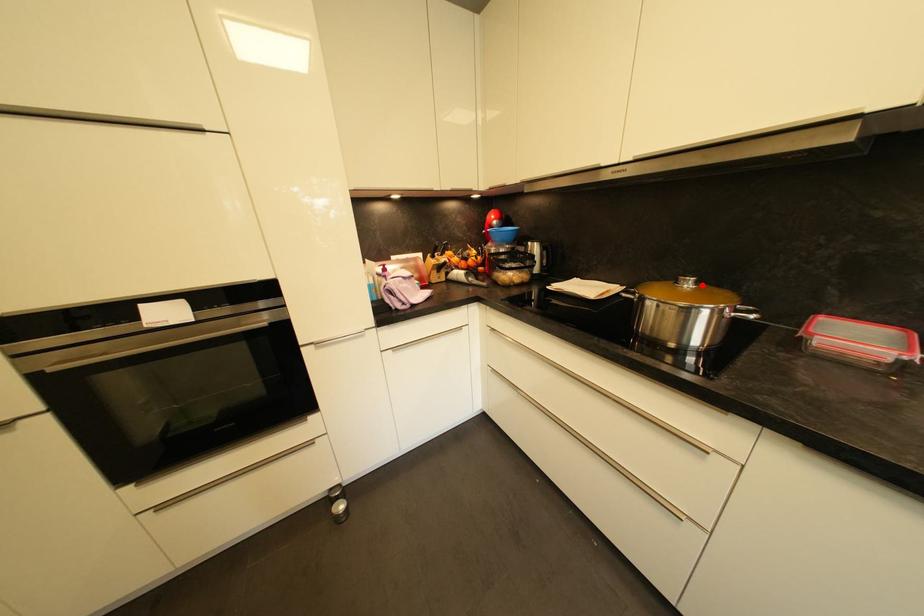
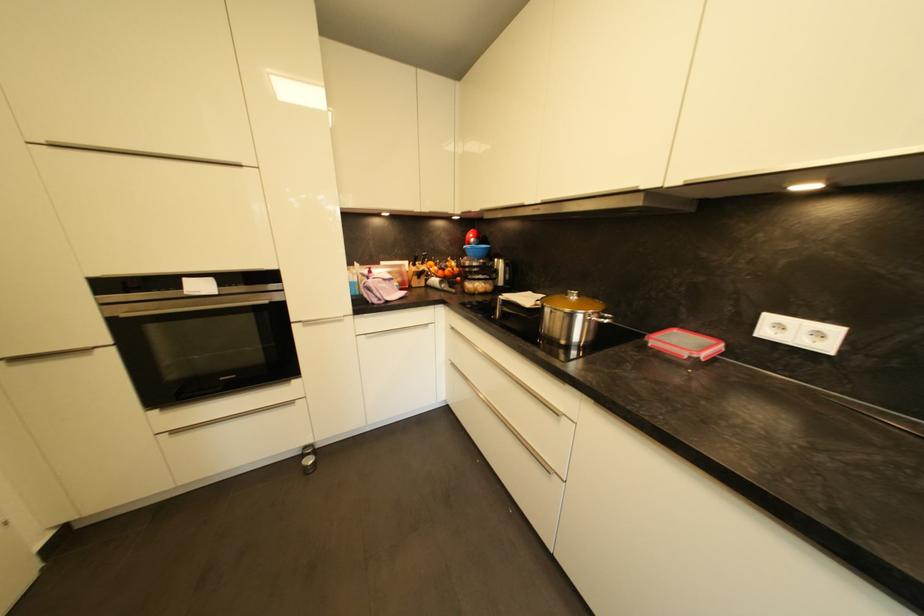
The point at the highlighted location is marked in the first image. Where is the corresponding point in the second image?

(584, 298)